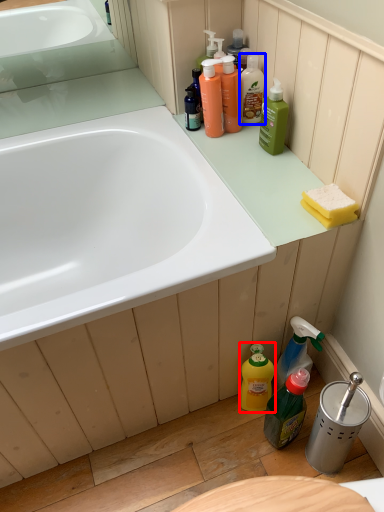
Question: Which object is closer to the camera taking this photo, cleaning product (highlighted by a red box) or cleaning product (highlighted by a blue box)?

Choices:
 (A) cleaning product
 (B) cleaning product

Answer: (A)